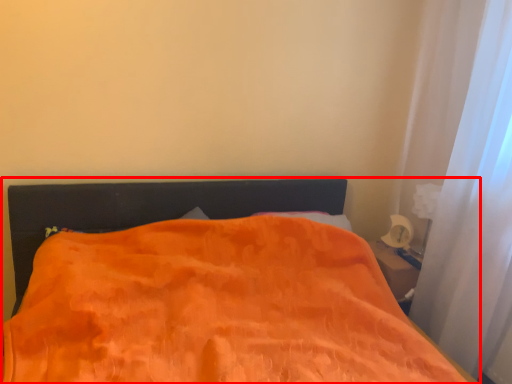
Question: From the image's perspective, what is the correct spatial relationship of bed (annotated by the red box) in relation to curtain?

Choices:
 (A) below
 (B) above

Answer: (A)